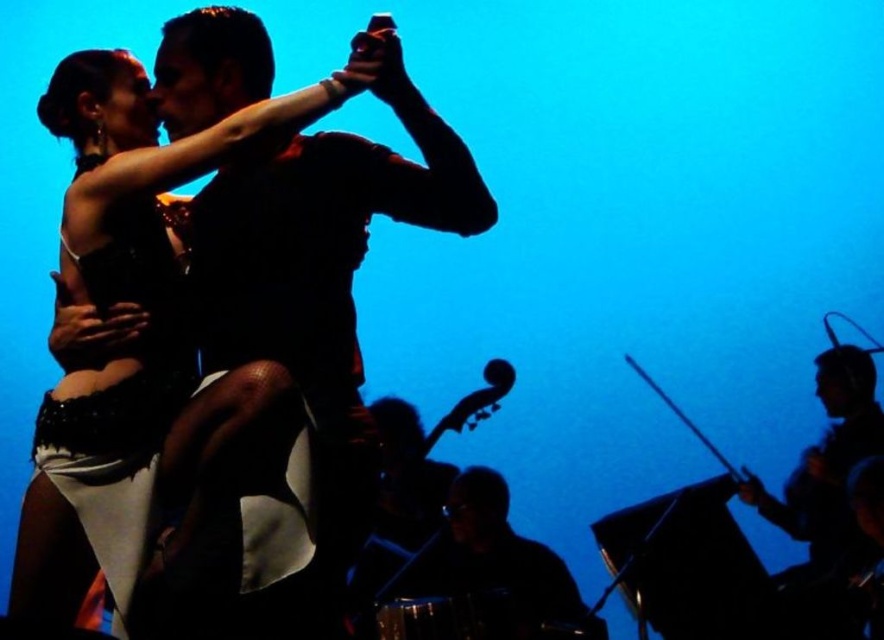
Is shiny black dress at center positioned behind silvery metallic drum at lower right?

No, shiny black dress at center is in front of silvery metallic drum at lower right.

Image resolution: width=884 pixels, height=640 pixels. Describe the element at coordinates (143, 170) in the screenshot. I see `shiny black dress at center` at that location.

Locate an element on the screen. shiny black dress at center is located at coordinates (143, 170).